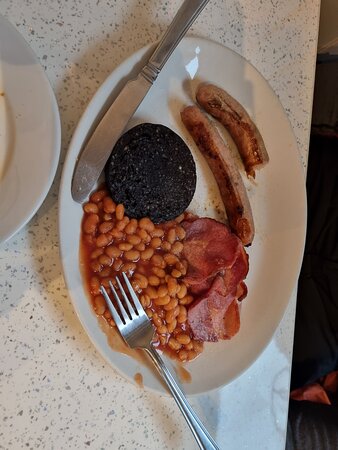
In order to click on round, white plate in this screenshot , I will do (227, 369), (43, 157).